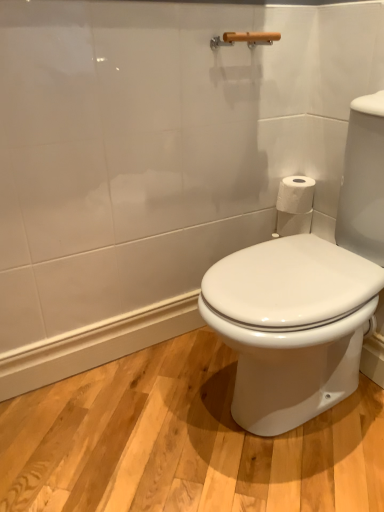
What is the approximate width of white matte toilet paper at upper right?

It is 5.30 inches.

You are a GUI agent. You are given a task and a screenshot of the screen. Output one action in this format:
    pyautogui.click(x=<x>, y=<y>)
    Task: Click on the white matte toilet paper at upper right
    The width and height of the screenshot is (384, 512).
    Given the screenshot: What is the action you would take?
    pyautogui.click(x=295, y=195)

In order to face white matte toilet paper at upper right, should I rotate leftwards or rightwards?

Turn right approximately 14.099 degrees to face it.

What do you see at coordinates (295, 195) in the screenshot? I see `white matte toilet paper at upper right` at bounding box center [295, 195].

What are the coordinates of `white matte toilet paper at upper right` in the screenshot? It's located at (295, 195).